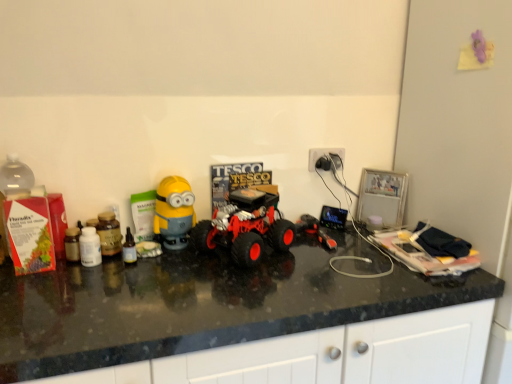
At what (x,y) coordinates should I click in order to perform the action: click on free space between rubberized red monster truck at center, which is counted as the second toy, starting from the left, and yellow matte minion toy at center-left, arranged as the third toy when viewed from the right. Please return your answer as a coordinate pair (x, y). This screenshot has width=512, height=384. Looking at the image, I should click on (196, 263).